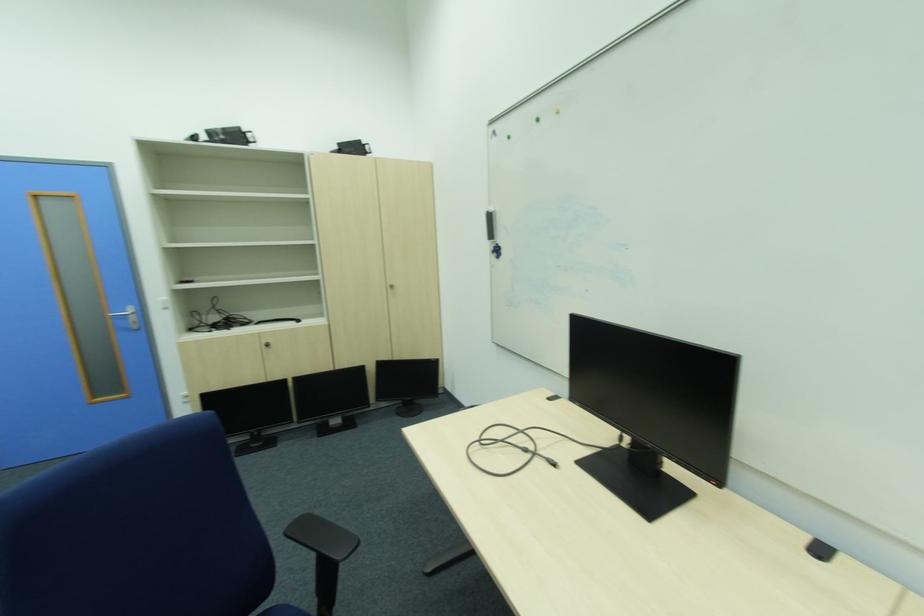
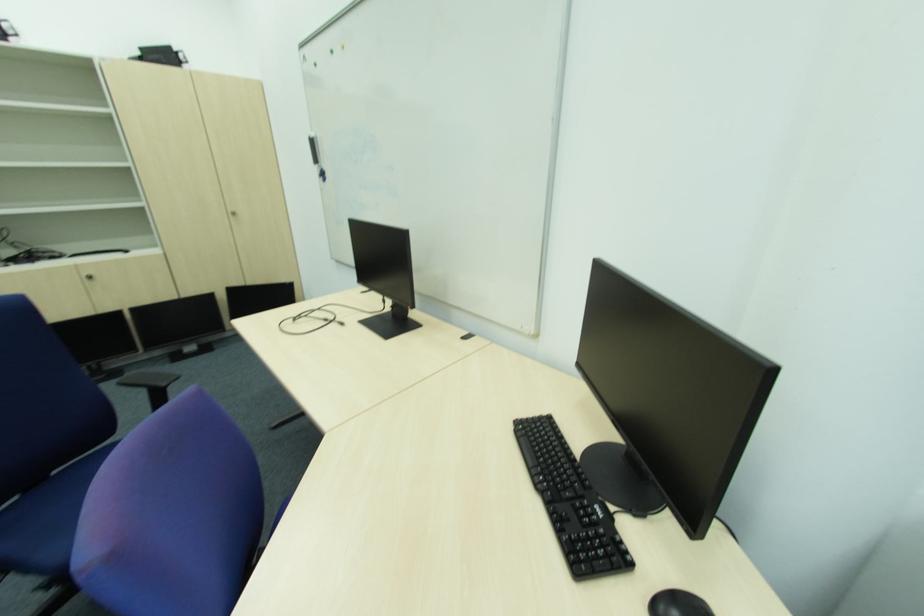
In the second image, find the point that corresponds to the point at 396,288 in the first image.

(237, 217)